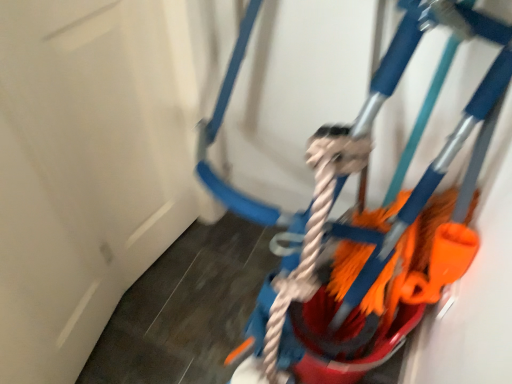
Describe the element at coordinates (298, 90) in the screenshot. I see `orange fabric mop at right` at that location.

The height and width of the screenshot is (384, 512). In order to click on orange fabric mop at right in this screenshot , I will do `click(298, 90)`.

This screenshot has height=384, width=512. I want to click on white matte door at upper left, so click(87, 168).

This screenshot has width=512, height=384. What do you see at coordinates (87, 168) in the screenshot?
I see `white matte door at upper left` at bounding box center [87, 168].

Where is `orange fabric mop at right`? orange fabric mop at right is located at coordinates (298, 90).

Considering the positions of objects orange fabric mop at right and white matte door at upper left in the image provided, who is more to the right, orange fabric mop at right or white matte door at upper left?

From the viewer's perspective, orange fabric mop at right appears more on the right side.

Between orange fabric mop at right and white matte door at upper left, which one is positioned in front?

white matte door at upper left is closer to the camera.

Does point (451, 346) lie behind point (7, 203)?

That is True.

From the image's perspective, would you say orange fabric mop at right is positioned over white matte door at upper left?

Correct, orange fabric mop at right appears higher than white matte door at upper left in the image.

From a real-world perspective, which is physically below, orange fabric mop at right or white matte door at upper left?

orange fabric mop at right is physically lower.

Can you confirm if orange fabric mop at right is thinner than white matte door at upper left?

No, orange fabric mop at right is not thinner than white matte door at upper left.

In terms of height, does orange fabric mop at right look taller or shorter compared to white matte door at upper left?

Clearly, orange fabric mop at right is shorter compared to white matte door at upper left.

Who is bigger, orange fabric mop at right or white matte door at upper left?

orange fabric mop at right.

Consider the image. Is orange fabric mop at right not inside white matte door at upper left?

Absolutely, orange fabric mop at right is external to white matte door at upper left.

Would you say orange fabric mop at right is a long distance from white matte door at upper left?

No, orange fabric mop at right is not far away from white matte door at upper left.

Consider the image. Is orange fabric mop at right turned away from white matte door at upper left?

No, white matte door at upper left is not at the back of orange fabric mop at right.

Measure the distance between orange fabric mop at right and white matte door at upper left.

orange fabric mop at right and white matte door at upper left are 15.02 inches apart.

I want to click on toy above the white matte door at upper left (from the image's perspective), so click(298, 90).

Is white matte door at upper left to the left of orange fabric mop at right from the viewer's perspective?

Correct, you'll find white matte door at upper left to the left of orange fabric mop at right.

Does white matte door at upper left lie in front of orange fabric mop at right?

Yes, it is in front of orange fabric mop at right.

Between point (161, 230) and point (194, 21), which one is positioned in front?

The point (194, 21) is closer to the camera.

From the image's perspective, relative to orange fabric mop at right, is white matte door at upper left above or below?

Clearly, from the image's perspective, white matte door at upper left is below orange fabric mop at right.

From a real-world perspective, who is located higher, white matte door at upper left or orange fabric mop at right?

white matte door at upper left, from a real-world perspective.

In terms of width, does white matte door at upper left look wider or thinner when compared to orange fabric mop at right?

In the image, white matte door at upper left appears to be more narrow than orange fabric mop at right.

Can you confirm if white matte door at upper left is shorter than orange fabric mop at right?

Incorrect, the height of white matte door at upper left does not fall short of that of orange fabric mop at right.

Considering the sizes of objects white matte door at upper left and orange fabric mop at right in the image provided, who is bigger, white matte door at upper left or orange fabric mop at right?

orange fabric mop at right.

In the scene shown: Would you say white matte door at upper left is outside orange fabric mop at right?

That's correct, white matte door at upper left is outside of orange fabric mop at right.

Is white matte door at upper left placed right next to orange fabric mop at right?

No, white matte door at upper left is not with orange fabric mop at right.

Is white matte door at upper left looking in the opposite direction of orange fabric mop at right?

No, white matte door at upper left is not facing the opposite direction of orange fabric mop at right.

Can you tell me how much white matte door at upper left and orange fabric mop at right differ in facing direction?

The facing directions of white matte door at upper left and orange fabric mop at right are 90.6 degrees apart.

How much distance is there between white matte door at upper left and orange fabric mop at right?

The distance of white matte door at upper left from orange fabric mop at right is 15.02 inches.

Locate an element on the screen. toy to the right of white matte door at upper left is located at coordinates (298, 90).

Locate an element on the screen. door above the orange fabric mop at right (from a real-world perspective) is located at coordinates (87, 168).

Identify the location of toy that is above the white matte door at upper left (from the image's perspective). This screenshot has width=512, height=384. click(x=298, y=90).